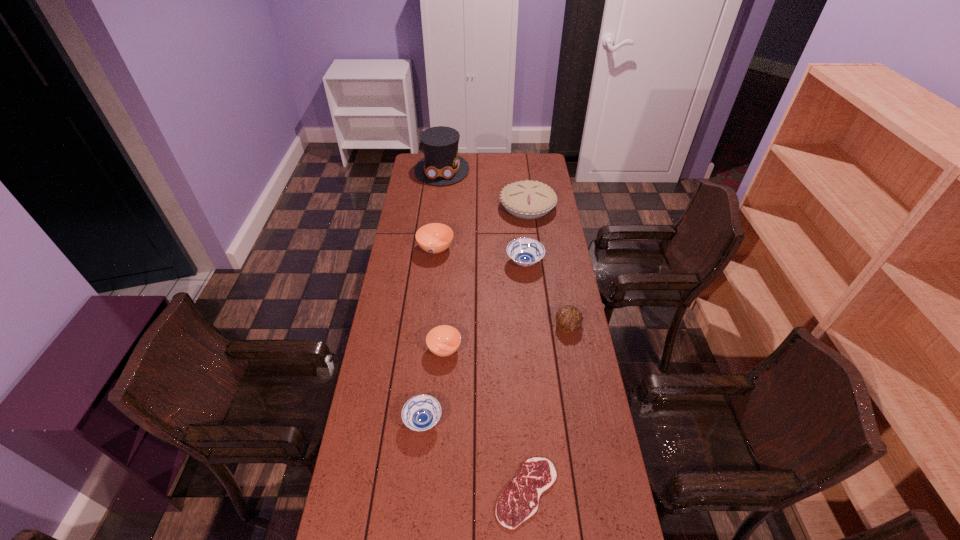
This screenshot has height=540, width=960. I want to click on free spot at the far left corner of the desktop, so click(x=410, y=173).

You are a GUI agent. You are given a task and a screenshot of the screen. Output one action in this format:
    pyautogui.click(x=<x>, y=<y>)
    Task: Click on the vacant space that's between the pie and the muffin
    This screenshot has height=540, width=960.
    Given the screenshot: What is the action you would take?
    pyautogui.click(x=548, y=267)

At what (x,y) coordinates should I click in order to perform the action: click on empty location between the shortest object and the muffin. Please return your answer as a coordinate pair (x, y). Looking at the image, I should click on (547, 409).

This screenshot has height=540, width=960. Find the location of `free space between the bigger peach soup bowl and the second nearest soup bowl`. free space between the bigger peach soup bowl and the second nearest soup bowl is located at coordinates (440, 299).

Identify the location of unoccupied area between the farther peach soup bowl and the seventh shortest object. The width and height of the screenshot is (960, 540). (482, 228).

This screenshot has height=540, width=960. Find the location of `free area in between the muffin and the right blue soup bowl`. free area in between the muffin and the right blue soup bowl is located at coordinates coord(546,294).

This screenshot has height=540, width=960. In order to click on free spot between the shortest object and the farthest object in this screenshot , I will do `click(485, 331)`.

Find the location of `vacant region between the dress hat and the nearer peach soup bowl`. vacant region between the dress hat and the nearer peach soup bowl is located at coordinates (444, 260).

Image resolution: width=960 pixels, height=540 pixels. I want to click on blank region between the pie and the farther peach soup bowl, so click(x=482, y=228).

Identify the location of object that stands as the fourth closest to the muffin. This screenshot has height=540, width=960. (421, 412).